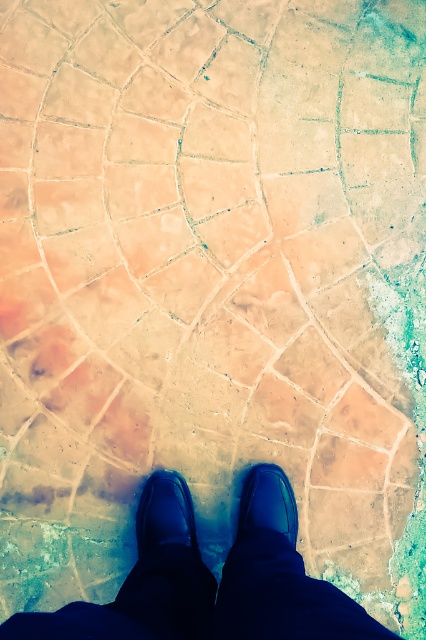
You are a photographer trying to capture the reflection of the shiny black shoe at center and the matte black shoe at center on the tiled floor. Which shoe will have a clearer reflection?

The shiny black shoe at center will have a clearer reflection because it is positioned under the matte black shoe at center, allowing its surface to reflect more clearly.

You are standing in the room and want to place a small plant pot between the two points, point (x=273, y=605) and point (x=253, y=486). Which point should the plant pot be closer to in order to be nearer to the viewer?

The plant pot should be closer to point (x=273, y=605) because it is closer to the viewer than point (x=253, y=486).